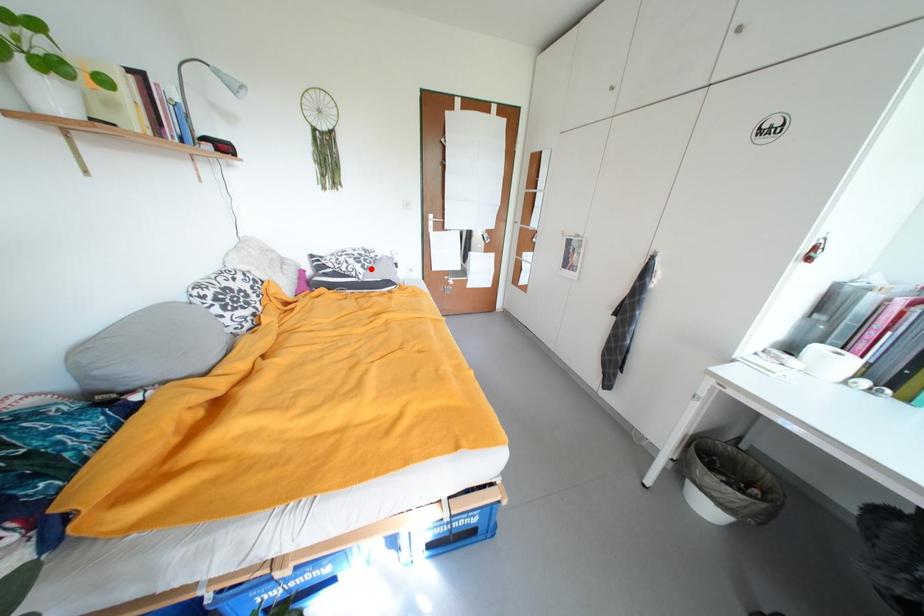
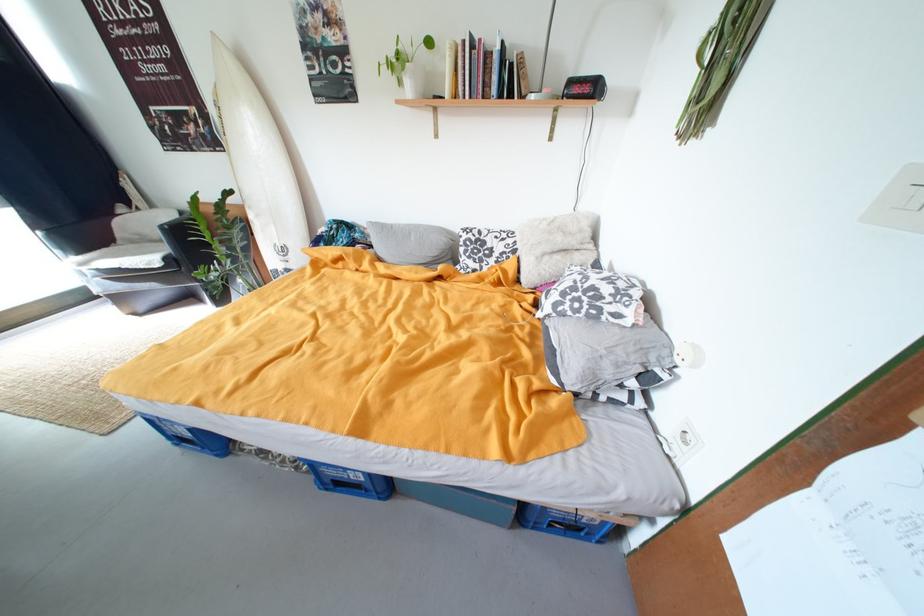
Find the pixel in the second image that matches the highlighted location in the first image.

(564, 306)